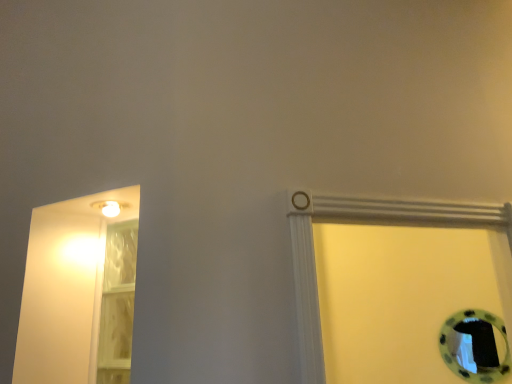
Question: From the image's perspective, does white glossy light fixture at upper left appear lower than transparent plastic door at left?

Choices:
 (A) no
 (B) yes

Answer: (A)

Question: Considering the relative positions of white glossy light fixture at upper left and transparent plastic door at left in the image provided, is white glossy light fixture at upper left to the left of transparent plastic door at left from the viewer's perspective?

Choices:
 (A) no
 (B) yes

Answer: (B)

Question: Is white glossy light fixture at upper left further to the viewer compared to transparent plastic door at left?

Choices:
 (A) no
 (B) yes

Answer: (A)

Question: Could you tell me if white glossy light fixture at upper left is facing transparent plastic door at left?

Choices:
 (A) yes
 (B) no

Answer: (B)

Question: Can you confirm if white glossy light fixture at upper left is wider than transparent plastic door at left?

Choices:
 (A) no
 (B) yes

Answer: (B)

Question: Is white glossy light fixture at upper left thinner than transparent plastic door at left?

Choices:
 (A) yes
 (B) no

Answer: (B)

Question: Does transparent plastic door at left come behind white glossy light fixture at upper left?

Choices:
 (A) yes
 (B) no

Answer: (A)

Question: Considering the relative sizes of transparent plastic door at left and white glossy light fixture at upper left in the image provided, is transparent plastic door at left wider than white glossy light fixture at upper left?

Choices:
 (A) yes
 (B) no

Answer: (B)

Question: Can you confirm if transparent plastic door at left is positioned to the left of white glossy light fixture at upper left?

Choices:
 (A) no
 (B) yes

Answer: (A)

Question: Does transparent plastic door at left turn towards white glossy light fixture at upper left?

Choices:
 (A) yes
 (B) no

Answer: (A)

Question: Considering the relative positions of transparent plastic door at left and white glossy light fixture at upper left in the image provided, is transparent plastic door at left to the right of white glossy light fixture at upper left from the viewer's perspective?

Choices:
 (A) yes
 (B) no

Answer: (A)

Question: Is transparent plastic door at left oriented away from white glossy light fixture at upper left?

Choices:
 (A) yes
 (B) no

Answer: (B)

Question: Is transparent plastic door at left situated inside white glossy light fixture at upper left or outside?

Choices:
 (A) inside
 (B) outside

Answer: (B)